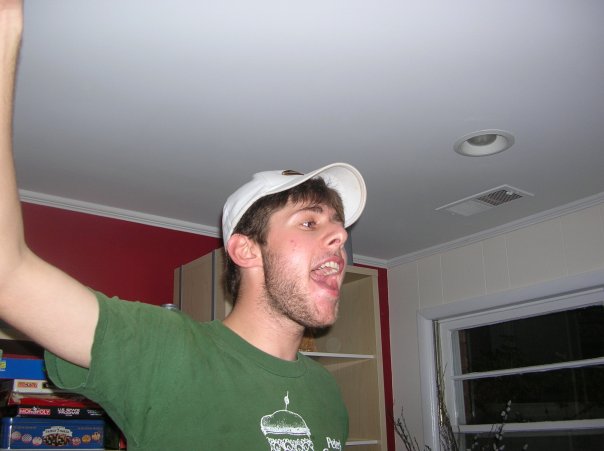
I want to click on shelf, so click(x=364, y=331).